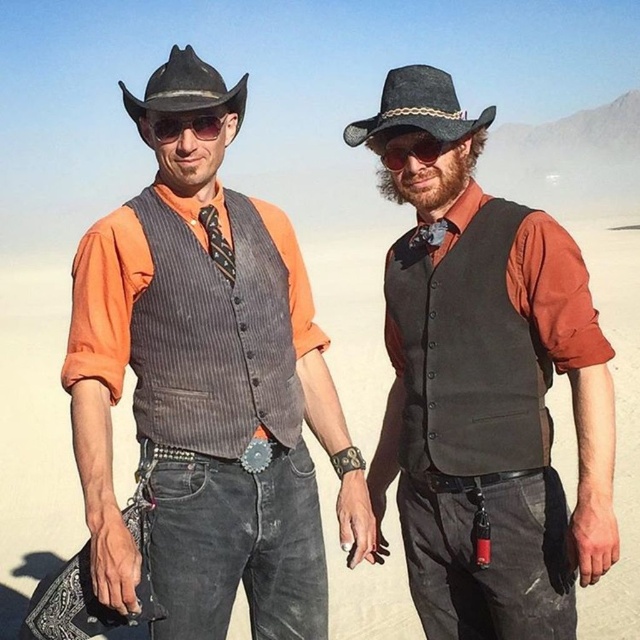
You are a fashion designer analyzing the outfit of the person on the left. Which item is located closer to the bottom of the image, the pinstriped wool vest at center or the matte black sunglasses at upper center?

The pinstriped wool vest at center is positioned under the matte black sunglasses at upper center, so the pinstriped wool vest at center is closer to the bottom of the image.